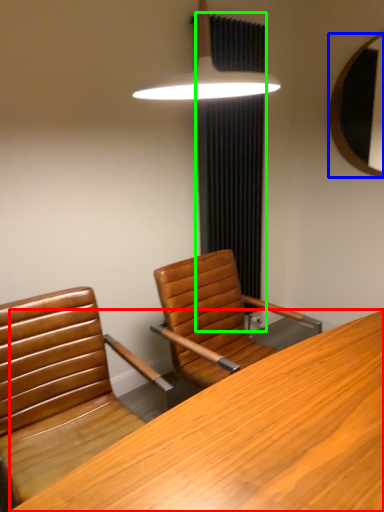
Question: Estimate the real-world distances between objects in this image. Which object is closer to desk (highlighted by a red box), mirror (highlighted by a blue box) or curtain (highlighted by a green box)?

Choices:
 (A) mirror
 (B) curtain

Answer: (B)